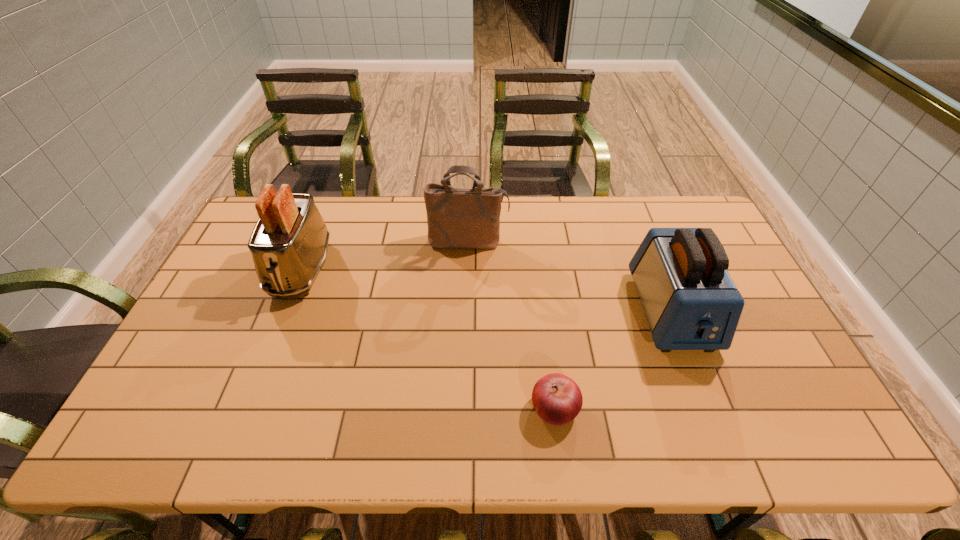
Identify which object is located as the nearest to the shoulder bag. Please provide its 2D coordinates. Your answer should be formatted as a tuple, i.e. [(x, y)], where the tuple contains the x and y coordinates of a point satisfying the conditions above.

[(289, 243)]

Identify which object is the second closest to the rightmost object. Please provide its 2D coordinates. Your answer should be formatted as a tuple, i.e. [(x, y)], where the tuple contains the x and y coordinates of a point satisfying the conditions above.

[(457, 218)]

In order to click on vacant space that satisfies the following two spatial constraints: 1. on the front-facing side of the second object from left to right; 2. on the right side of the apple in this screenshot , I will do `click(463, 409)`.

Identify the location of free space that satisfies the following two spatial constraints: 1. on the side of the apple with the control lever; 2. on the left side of the leftmost object. (246, 409).

Locate an element on the screen. vacant space that satisfies the following two spatial constraints: 1. on the front-facing side of the second object from left to right; 2. on the right side of the apple is located at coordinates (463, 409).

The width and height of the screenshot is (960, 540). In order to click on free space that satisfies the following two spatial constraints: 1. on the front-facing side of the shoulder bag; 2. on the right side of the nearest object in this screenshot , I will do `click(463, 409)`.